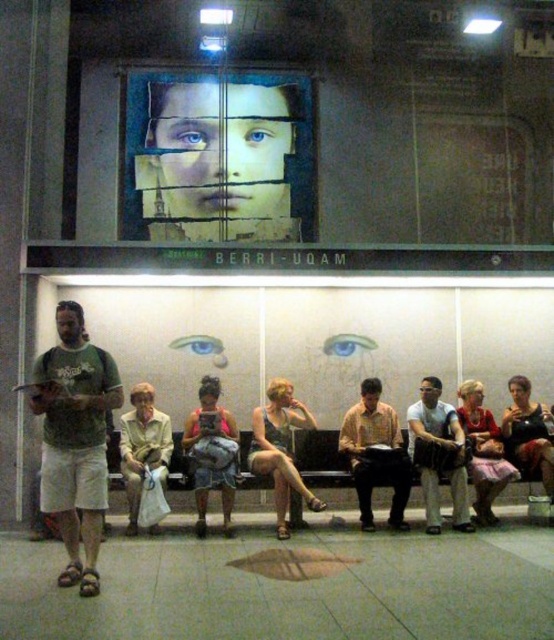
Question: Can you confirm if matte gray shirt at center is thinner than denim shorts at center?

Choices:
 (A) yes
 (B) no

Answer: (B)

Question: Which of the following is the farthest from the observer?

Choices:
 (A) (500, 444)
 (B) (152, 227)
 (C) (150, 424)
 (D) (532, 440)

Answer: (B)

Question: Is brown leather jacket at center thinner than matte black tank top at center?

Choices:
 (A) yes
 (B) no

Answer: (A)

Question: Which of these objects is positioned closest to the smooth textured face at center?

Choices:
 (A) denim shorts at center
 (B) matte black tank top at center
 (C) matte pink dress at lower right
 (D) matte black purse at lower right

Answer: (A)

Question: Does brown leather jacket at center have a lesser width compared to denim shorts at center?

Choices:
 (A) no
 (B) yes

Answer: (A)

Question: Estimate the real-world distances between objects in this image. Which object is closer to the matte black tank top at center?

Choices:
 (A) green cotton t-shirt at left
 (B) brown leather jacket at center
 (C) smooth textured face at center
 (D) matte gray shirt at center

Answer: (B)